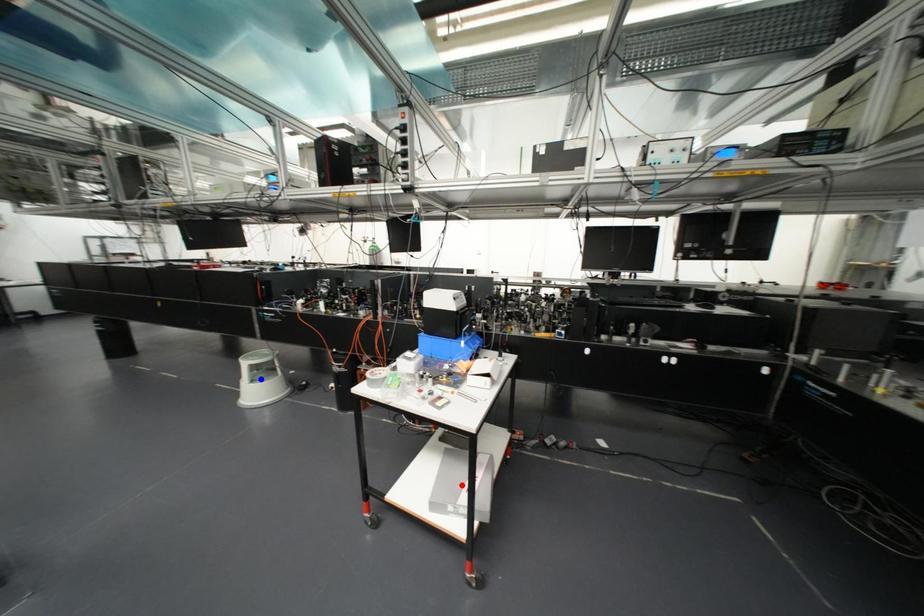
Question: Two points are marked on the image. Which point is closer to the camera?

Choices:
 (A) Blue point is closer.
 (B) Red point is closer.

Answer: (B)